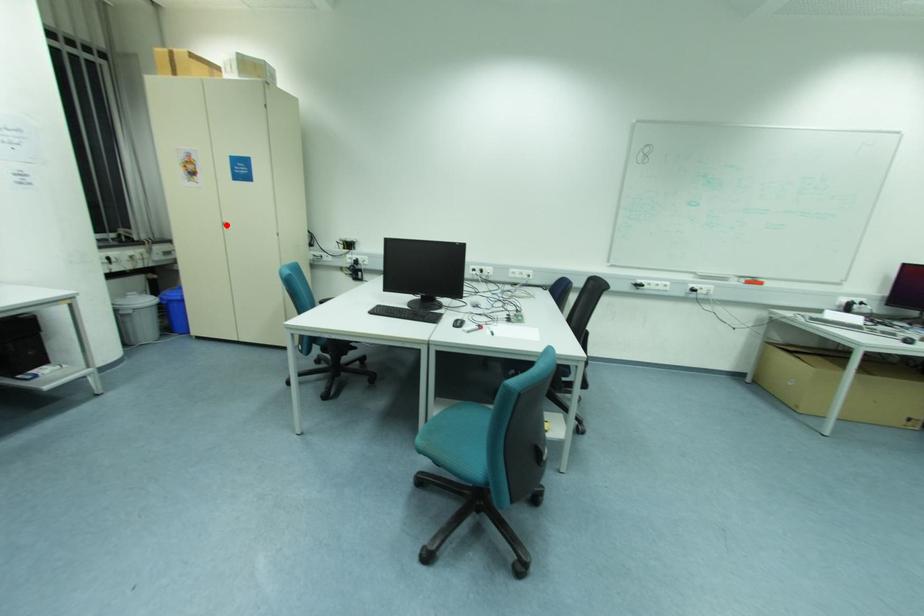
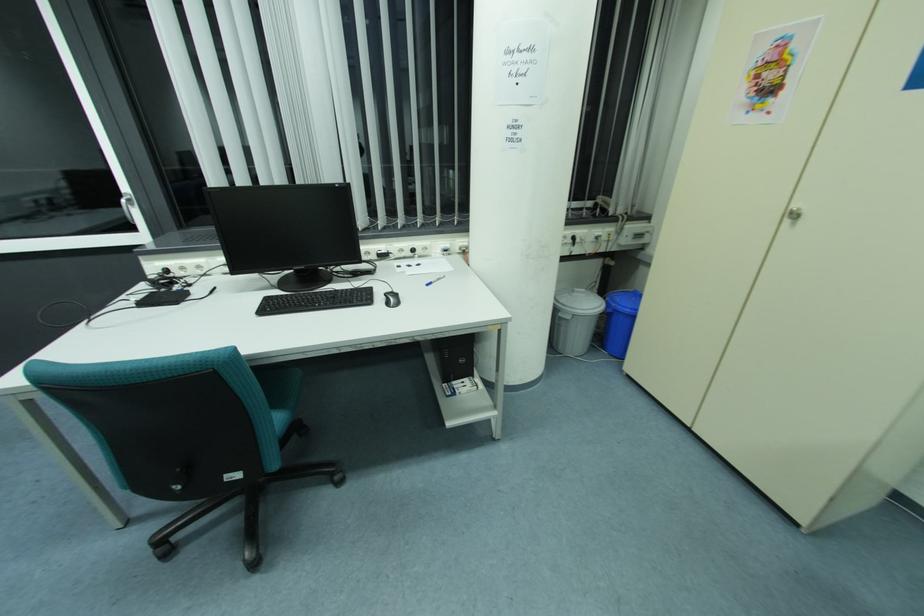
Locate, in the second image, the point that corresponds to the highlighted location in the first image.

(795, 216)